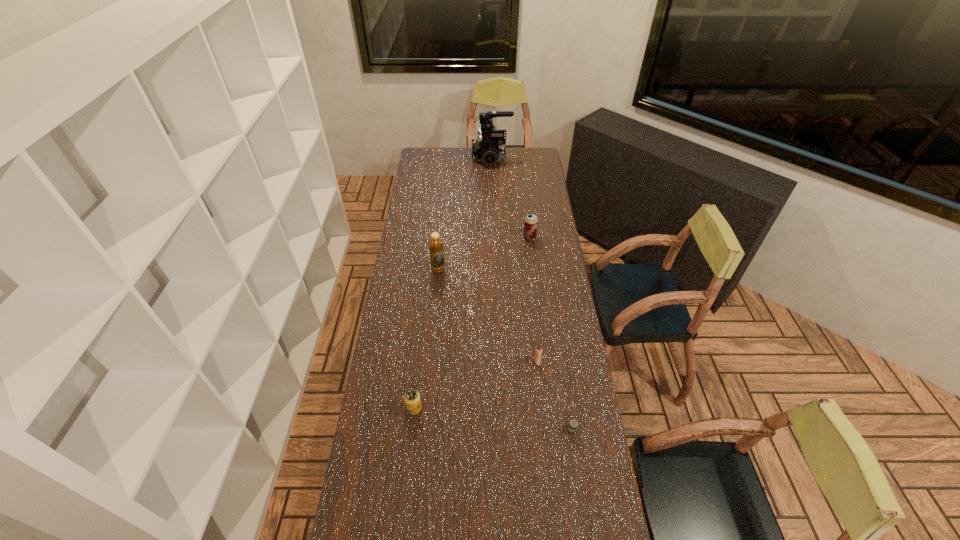
The height and width of the screenshot is (540, 960). I want to click on vacant space that satisfies the following two spatial constraints: 1. on the lens mount of the tallest object; 2. on the right side of the farthest beer can, so click(494, 237).

Find the location of a particular element. This screenshot has width=960, height=540. blank area in the image that satisfies the following two spatial constraints: 1. on the back side of the igniter; 2. on the right side of the fourth shortest object is located at coordinates (523, 237).